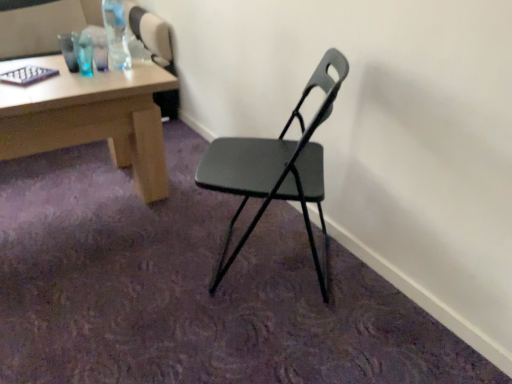
This screenshot has width=512, height=384. Identify the location of matte black chair at center. (276, 168).

Locate an element on the screen. clear plastic bottle at upper left is located at coordinates (116, 34).

This screenshot has width=512, height=384. Find the location of `matte black chair at center`. matte black chair at center is located at coordinates (276, 168).

Is matte black chair at center touching clear plastic bottle at upper left?

There is a gap between matte black chair at center and clear plastic bottle at upper left.

This screenshot has width=512, height=384. Find the location of `bottle that is above the matte black chair at center (from a real-world perspective)`. bottle that is above the matte black chair at center (from a real-world perspective) is located at coordinates (116, 34).

Looking at the image, does matte black chair at center seem bigger or smaller compared to clear plastic bottle at upper left?

Considering their sizes, matte black chair at center takes up more space than clear plastic bottle at upper left.

Is point (320, 197) positioned in front of point (117, 16)?

Yes, point (320, 197) is closer to viewer.

Is clear plastic bottle at upper left looking in the opposite direction of matte black chair at center?

No, clear plastic bottle at upper left is not facing away from matte black chair at center.

Considering the relative sizes of clear plastic bottle at upper left and matte black chair at center in the image provided, is clear plastic bottle at upper left smaller than matte black chair at center?

Yes.

Which is more distant, (112, 40) or (325, 298)?

The point (112, 40) is behind.

Is clear plastic bottle at upper left next to matte black chair at center?

There is a gap between clear plastic bottle at upper left and matte black chair at center.

Would you consider matte black chair at center to be distant from matte wood desk at upper left?

That's not correct — matte black chair at center is a little close to matte wood desk at upper left.

Can you confirm if matte black chair at center is bigger than matte wood desk at upper left?

Incorrect, matte black chair at center is not larger than matte wood desk at upper left.

From a real-world perspective, is matte black chair at center above or below matte wood desk at upper left?

In terms of real-world spatial position, matte black chair at center is above matte wood desk at upper left.

Which is closer to the camera, (297, 160) or (99, 105)?

Clearly, point (297, 160) is closer to the camera than point (99, 105).

Image resolution: width=512 pixels, height=384 pixels. Find the location of `chair located on the right of matte wood desk at upper left`. chair located on the right of matte wood desk at upper left is located at coordinates (276, 168).

From a real-world perspective, who is located higher, matte wood desk at upper left or matte black chair at center?

In real-world perspective, matte black chair at center is above.

Is matte wood desk at upper left oriented towards matte black chair at center?

Yes, matte wood desk at upper left is facing matte black chair at center.

Consider the image. From a real-world perspective, is matte wood desk at upper left below clear plastic bottle at upper left?

Yes, from a real-world perspective, matte wood desk at upper left is under clear plastic bottle at upper left.

Which of these two, matte wood desk at upper left or clear plastic bottle at upper left, is bigger?

matte wood desk at upper left.

Is point (99, 99) less distant than point (118, 42)?

Yes, it is.

Considering the sizes of objects matte wood desk at upper left and clear plastic bottle at upper left in the image provided, who is taller, matte wood desk at upper left or clear plastic bottle at upper left?

matte wood desk at upper left.

Would you say clear plastic bottle at upper left is outside matte wood desk at upper left?

clear plastic bottle at upper left is positioned outside matte wood desk at upper left.

Where is `desk that appears above the clear plastic bottle at upper left (from the image's perspective)`? This screenshot has width=512, height=384. desk that appears above the clear plastic bottle at upper left (from the image's perspective) is located at coordinates (90, 117).

Does clear plastic bottle at upper left come behind matte wood desk at upper left?

No, clear plastic bottle at upper left is closer to the camera.

Is clear plastic bottle at upper left smaller than matte wood desk at upper left?

Yes.

Where is `chair below the clear plastic bottle at upper left (from the image's perspective)`? chair below the clear plastic bottle at upper left (from the image's perspective) is located at coordinates (276, 168).

At what (x,y) coordinates should I click in order to perform the action: click on chair on the right of clear plastic bottle at upper left. Please return your answer as a coordinate pair (x, y). Image resolution: width=512 pixels, height=384 pixels. Looking at the image, I should click on (276, 168).

Based on their spatial positions, is matte wood desk at upper left or matte black chair at center further from clear plastic bottle at upper left?

The object further to clear plastic bottle at upper left is matte black chair at center.

Considering their positions, is clear plastic bottle at upper left positioned further to matte black chair at center than matte wood desk at upper left?

clear plastic bottle at upper left.

Looking at the image, which one is located further to matte black chair at center, matte wood desk at upper left or clear plastic bottle at upper left?

clear plastic bottle at upper left lies further to matte black chair at center than the other object.

Considering their positions, is clear plastic bottle at upper left positioned further to matte wood desk at upper left than matte black chair at center?

matte black chair at center.

Considering their positions, is matte black chair at center positioned closer to clear plastic bottle at upper left than matte wood desk at upper left?

The object closer to clear plastic bottle at upper left is matte wood desk at upper left.

Considering their positions, is matte black chair at center positioned closer to matte wood desk at upper left than clear plastic bottle at upper left?

clear plastic bottle at upper left is positioned closer to the anchor matte wood desk at upper left.

Locate an element on the screen. bottle between matte wood desk at upper left and matte black chair at center in the horizontal direction is located at coordinates (116, 34).